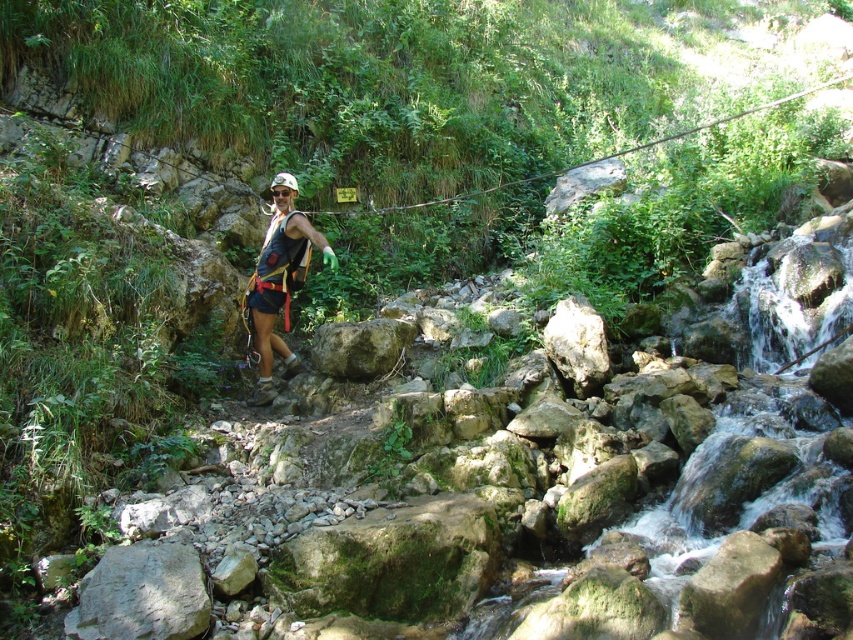
Question: Which point is farther to the camera?

Choices:
 (A) (415, 332)
 (B) (257, 266)

Answer: (A)

Question: Which point is closer to the camera?

Choices:
 (A) (262, 372)
 (B) (339, 371)

Answer: (B)

Question: Can you confirm if matte black vest at center is positioned to the left of green mossy rock at center?

Choices:
 (A) yes
 (B) no

Answer: (A)

Question: Is matte black vest at center to the right of green mossy rock at center from the viewer's perspective?

Choices:
 (A) yes
 (B) no

Answer: (B)

Question: From the image, what is the correct spatial relationship of matte black vest at center in relation to green mossy rock at center?

Choices:
 (A) above
 (B) below

Answer: (A)

Question: Which point appears closest to the camera in this image?

Choices:
 (A) (257, 396)
 (B) (381, 337)

Answer: (A)